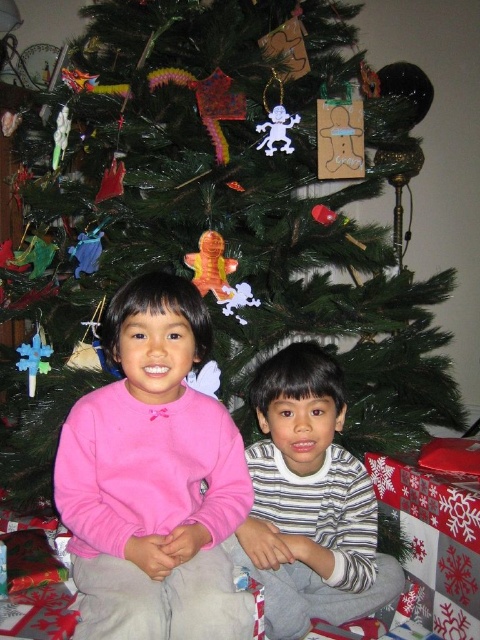
Question: Which object appears closest to the camera in this image?

Choices:
 (A) striped cotton shirt at lower center
 (B) pink fleece sweater at center

Answer: (B)

Question: Among these objects, which one is farthest from the camera?

Choices:
 (A) striped cotton shirt at lower center
 (B) pink fleece sweater at center

Answer: (A)

Question: Which point is closer to the camera taking this photo?

Choices:
 (A) (170, 618)
 (B) (252, 483)

Answer: (A)

Question: Is pink fleece sweater at center thinner than striped cotton shirt at lower center?

Choices:
 (A) no
 (B) yes

Answer: (B)

Question: Is pink fleece sweater at center behind striped cotton shirt at lower center?

Choices:
 (A) no
 (B) yes

Answer: (A)

Question: Does pink fleece sweater at center appear on the right side of striped cotton shirt at lower center?

Choices:
 (A) no
 (B) yes

Answer: (A)